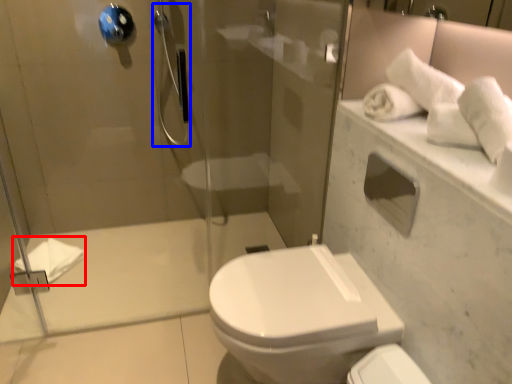
Question: Which of the following is the closest to the observer, bath towel (highlighted by a red box) or shower (highlighted by a blue box)?

Choices:
 (A) bath towel
 (B) shower

Answer: (B)